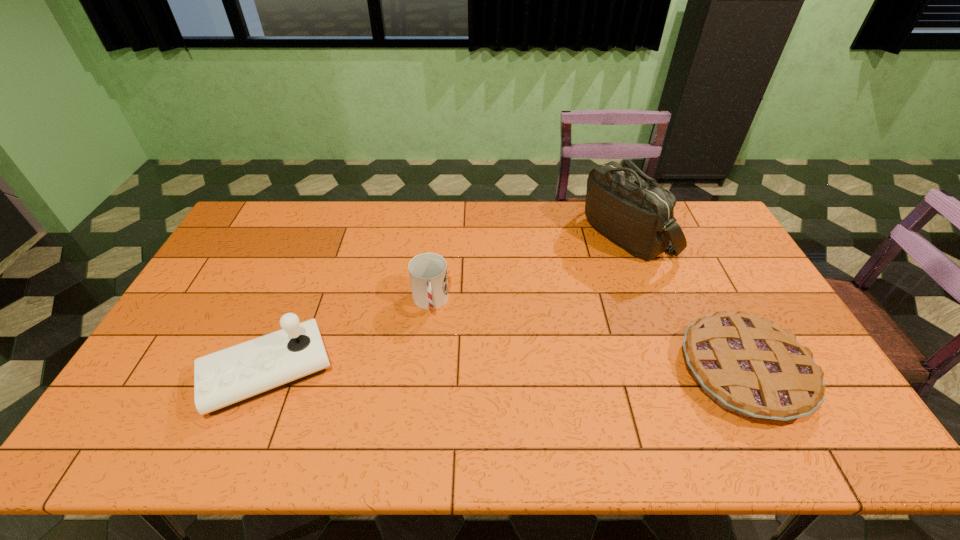
Locate an element on the screen. The width and height of the screenshot is (960, 540). vacant space on the desktop that is between the second tallest object and the shortest object and is positioned at the front padded panel of the farthest object is located at coordinates (486, 372).

This screenshot has width=960, height=540. Identify the location of vacant space on the desktop that is between the joystick and the pie and is positioned on the handle side of the third object from right to left. (436, 372).